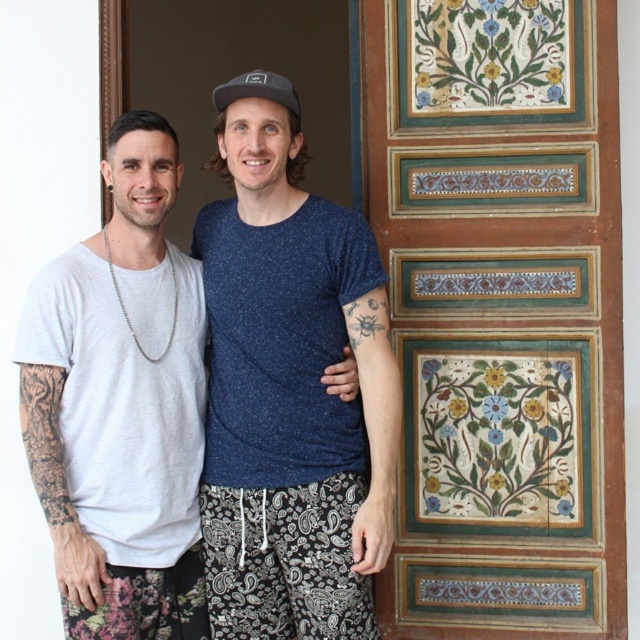
Is white cotton t-shirt at center to the left of white cotton t-shirt at left from the viewer's perspective?

In fact, white cotton t-shirt at center is to the right of white cotton t-shirt at left.

Where is `white cotton t-shirt at center`? The height and width of the screenshot is (640, 640). white cotton t-shirt at center is located at coordinates (291, 388).

The image size is (640, 640). I want to click on white cotton t-shirt at center, so click(291, 388).

This screenshot has height=640, width=640. Find the location of `white cotton t-shirt at center`. white cotton t-shirt at center is located at coordinates (291, 388).

Does wooden panel with painted floral design at right appear under white cotton t-shirt at center?

No, wooden panel with painted floral design at right is not below white cotton t-shirt at center.

Is wooden panel with painted floral design at right to the right of white cotton t-shirt at center from the viewer's perspective?

Yes, wooden panel with painted floral design at right is to the right of white cotton t-shirt at center.

Which is in front, point (524, 96) or point (250, 604)?

Point (250, 604) is in front.

This screenshot has height=640, width=640. In order to click on wooden panel with painted floral design at right in this screenshot , I will do `click(500, 310)`.

How much distance is there between wooden panel with painted floral design at right and white cotton t-shirt at left?

wooden panel with painted floral design at right is 1.84 meters away from white cotton t-shirt at left.

Is point (410, 157) positioned in front of point (208, 634)?

No.

Describe the element at coordinates (500, 310) in the screenshot. The height and width of the screenshot is (640, 640). I see `wooden panel with painted floral design at right` at that location.

This screenshot has height=640, width=640. In order to click on wooden panel with painted floral design at right in this screenshot , I will do `click(500, 310)`.